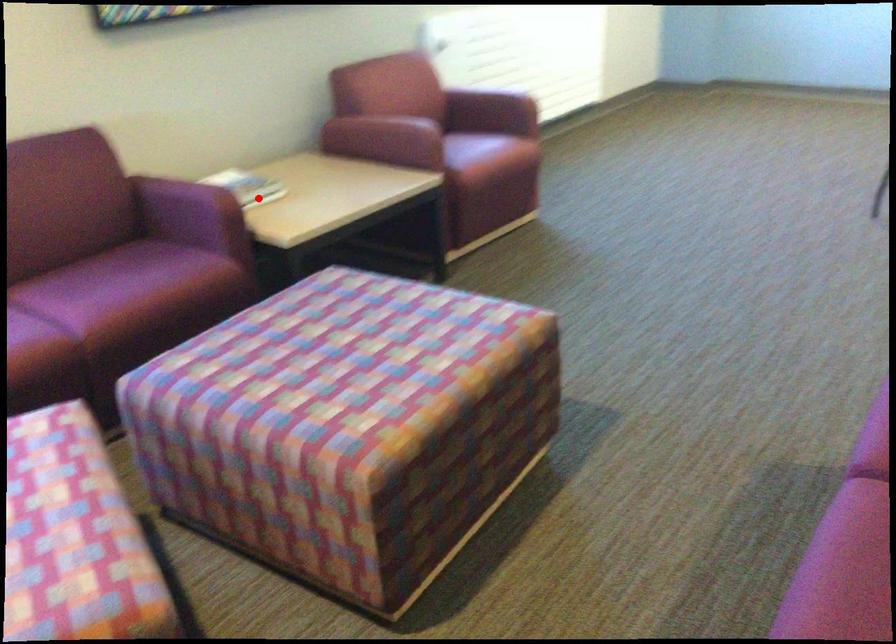
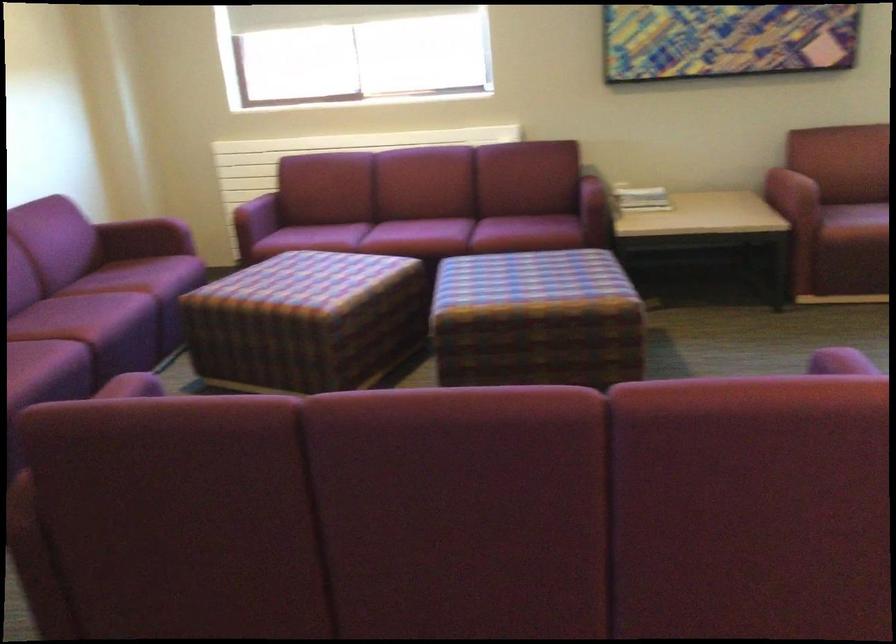
Question: A red point is marked in image1. In image2, is the corresponding 3D point closer to the camera or farther? Reply with the corresponding letter.

Choices:
 (A) The corresponding 3D point is closer.
 (B) The corresponding 3D point is farther.

Answer: (B)